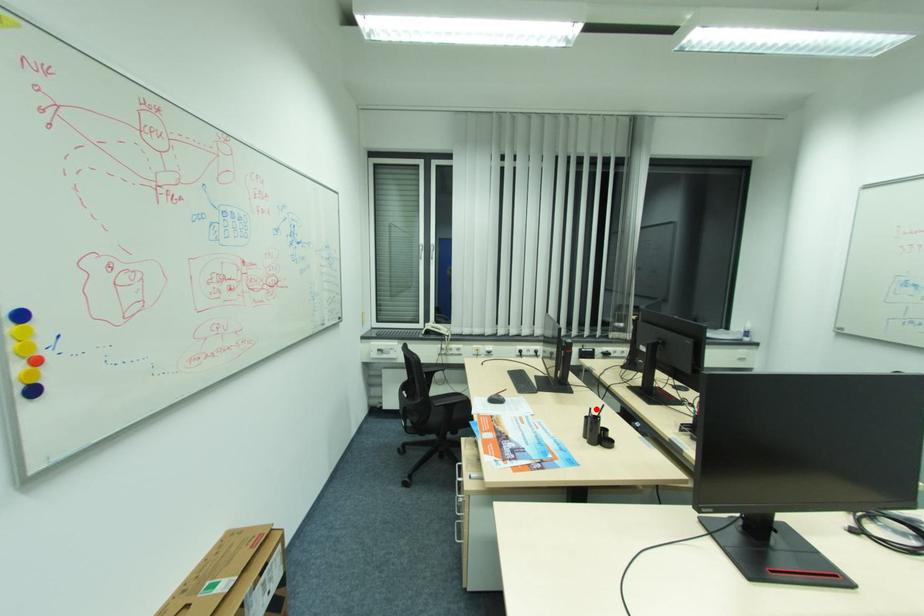
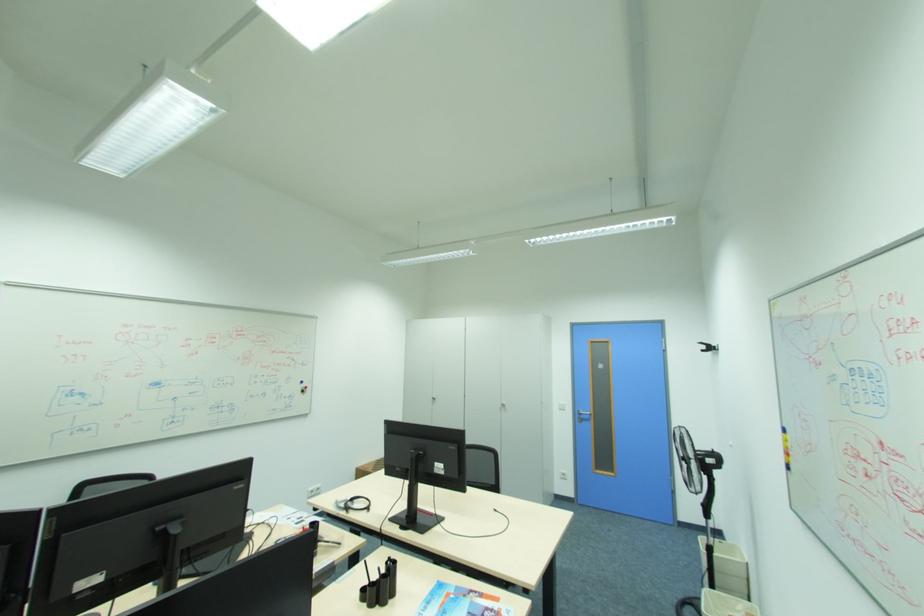
Question: I am providing you with two images of the same scene from different viewpoints. In image1, a red point is highlighted. Considering the same 3D point in image2, which of the following is correct?

Choices:
 (A) It is closer
 (B) It is farther

Answer: (B)